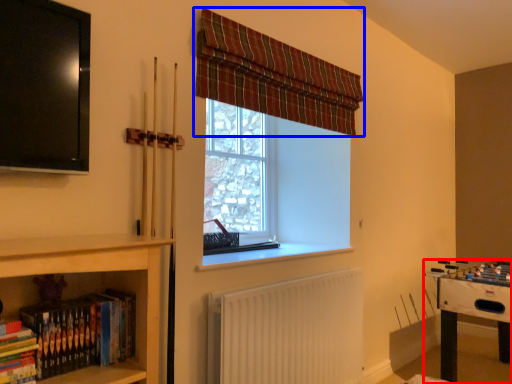
Question: Among these objects, which one is farthest to the camera, table (highlighted by a red box) or curtain (highlighted by a blue box)?

Choices:
 (A) table
 (B) curtain

Answer: (A)